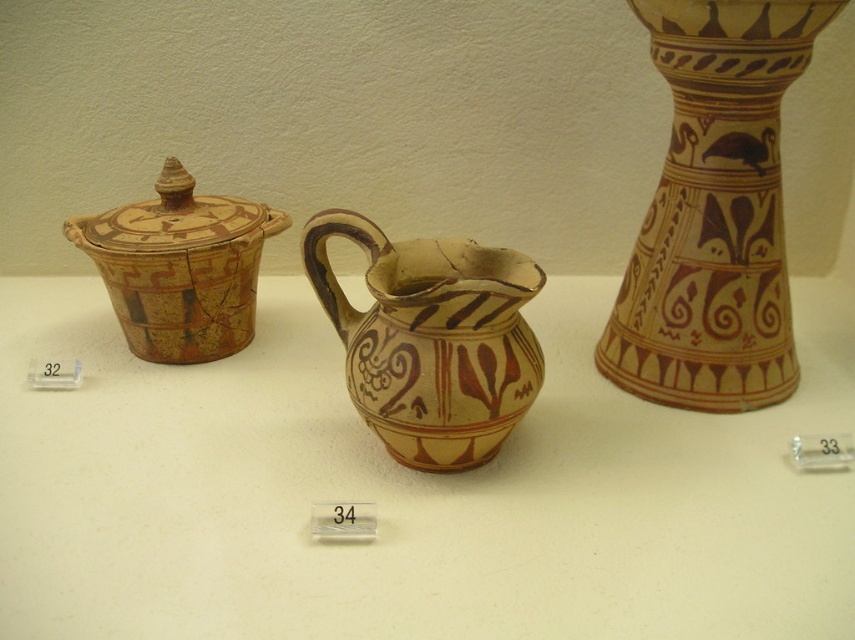
Consider the image. Which is above, matte clay vase at right or matte clay pitcher at center?

matte clay vase at right is above.

Does matte clay vase at right appear on the right side of matte clay pitcher at center?

Indeed, matte clay vase at right is positioned on the right side of matte clay pitcher at center.

Is point (759, 291) positioned before point (479, 458)?

No.

Find the location of a particular element. This screenshot has width=855, height=640. matte clay vase at right is located at coordinates (714, 211).

Who is higher up, matte ceramic pitcher at center or matte clay vase at right?

matte clay vase at right is higher up.

Which is behind, point (385, 625) or point (789, 362)?

The point (789, 362) is behind.

Is point (310, 620) positioned after point (679, 65)?

That is False.

This screenshot has width=855, height=640. I want to click on matte ceramic pitcher at center, so click(407, 492).

Can you confirm if matte ceramic pitcher at center is thinner than matte clay pot at left?

Incorrect, matte ceramic pitcher at center's width is not less than matte clay pot at left's.

Who is positioned more to the right, matte ceramic pitcher at center or matte clay pot at left?

matte ceramic pitcher at center

Identify the location of matte ceramic pitcher at center. This screenshot has height=640, width=855. (407, 492).